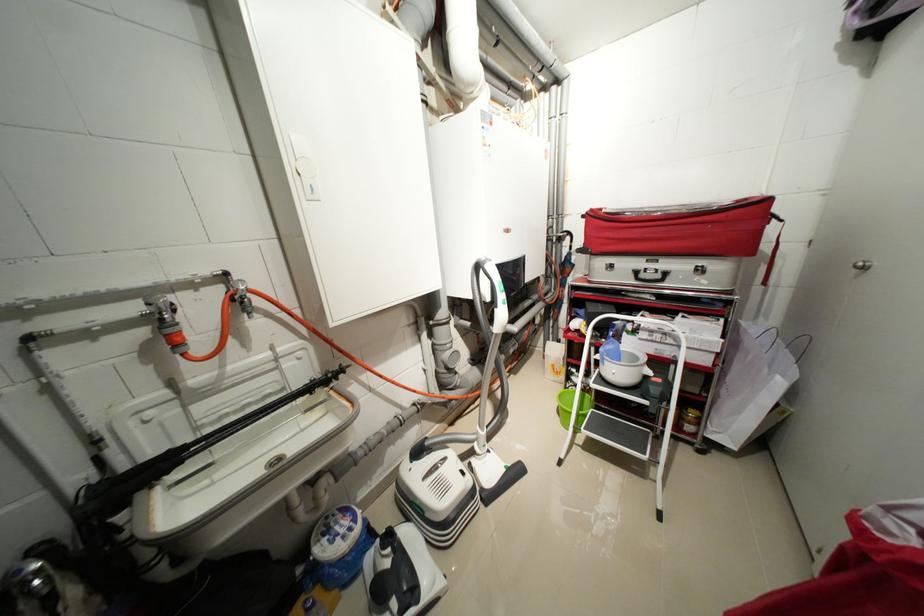
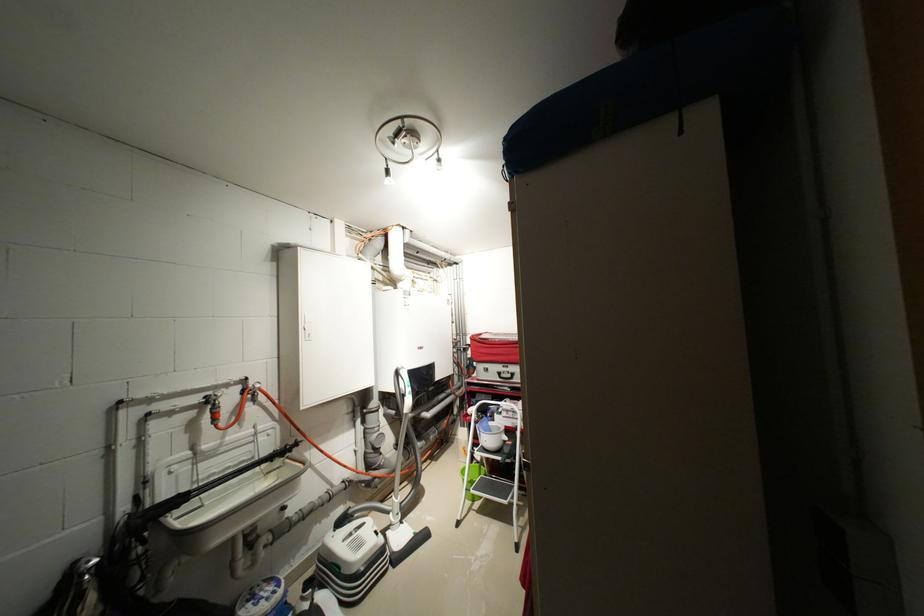
Where in the second image is the point corresponding to the point at 659,331 from the first image?

(515, 411)